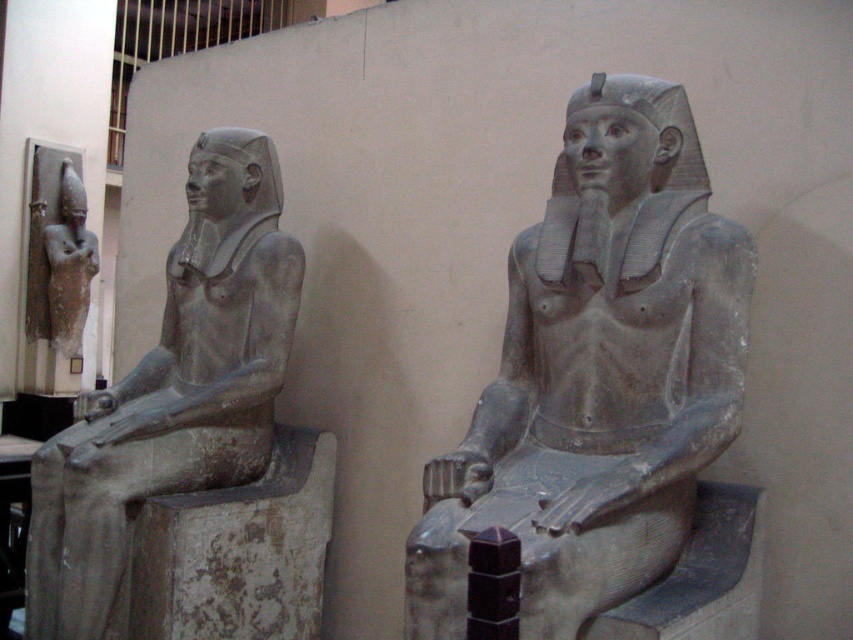
You are an archaeologist examining the ancient Egyptian statues. You notice a specific point marked at coordinates (596, 376). Which statue does this point belong to?

The point marked at coordinates (596, 376) is located on the gray stone statue at center.

You are an archaeologist examining two ancient Egyptian statues. You notice that the gray stone statue at center and the gray stone statue at left are both seated on stone thrones. Based on their positions and the scene described, which statue do you think represents a higher rank or status?

The gray stone statue at left represents a higher rank or status because it is taller than the gray stone statue at center, and in Egyptian art, larger size often symbolizes higher authority.

You are an archaeologist standing between two ancient Egyptian statues. The statue on the left has a nemes headdress with a uraeus, while the one on the right has a different headdress. You need to place a measuring tape between the two statues to determine their distance. The measuring tape can only extend 8 feet. Will it be sufficient to reach from the point on the left statue at coordinate point (613, 276) to the right statue?

The statues are 8.57 feet apart, so the measuring tape that can only extend 8 feet will not be sufficient to reach between the point on the left statue at coordinate point (613, 276) and the right statue.